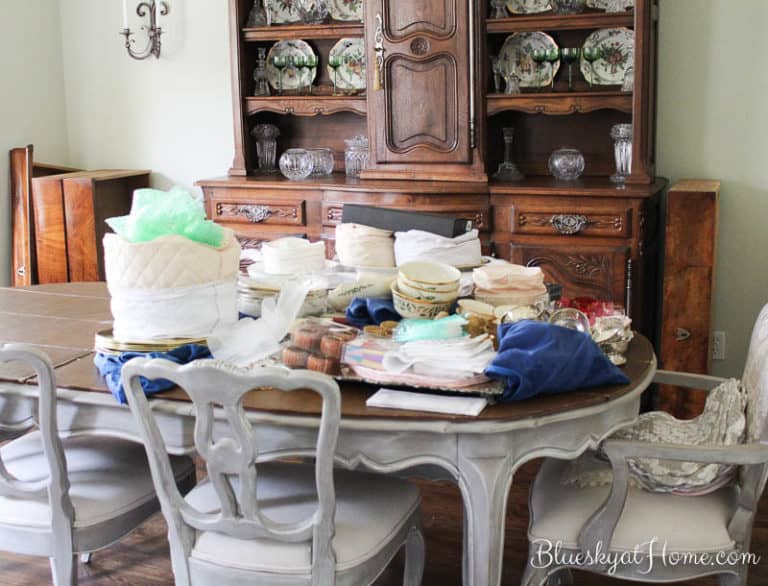
This screenshot has height=586, width=768. What are the coordinates of `cabinet` in the screenshot? It's located at click(414, 122), click(587, 250), click(267, 207), click(240, 118), click(328, 103), click(514, 103).